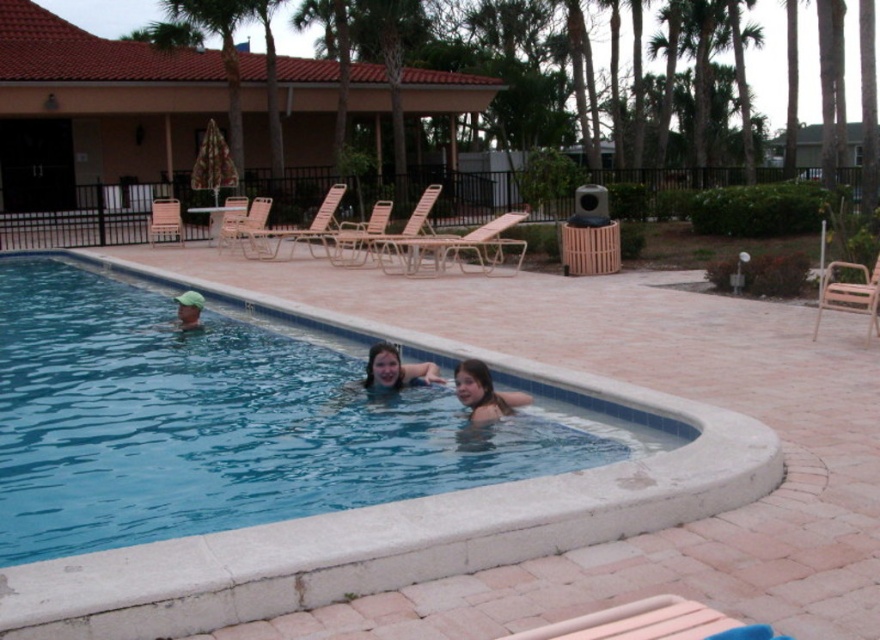
Question: Can you confirm if smooth skin girl at center is positioned to the right of smooth skin face at center?

Choices:
 (A) yes
 (B) no

Answer: (A)

Question: Which object appears closest to the camera in this image?

Choices:
 (A) smooth skin face at center
 (B) blue smooth water at center

Answer: (B)

Question: Which point appears farthest from the camera in this image?

Choices:
 (A) (189, 317)
 (B) (314, 440)
 (C) (488, 413)
 (D) (375, 355)

Answer: (A)

Question: Does blue smooth water at center appear on the right side of matte green cap at left?

Choices:
 (A) yes
 (B) no

Answer: (A)

Question: Is smooth skin girl at center bigger than smooth skin face at center?

Choices:
 (A) yes
 (B) no

Answer: (B)

Question: Which point is closer to the camera taking this photo?

Choices:
 (A) (199, 304)
 (B) (460, 394)
 (C) (422, 480)

Answer: (C)